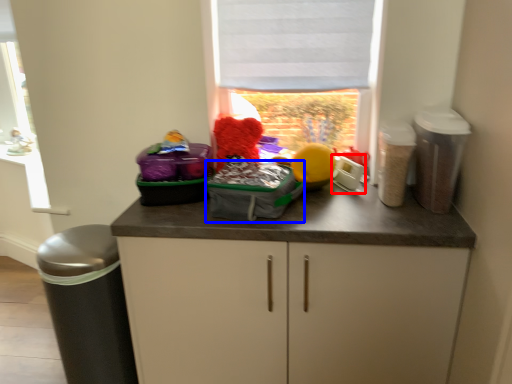
Question: Which point is closer to the camera, appliance (highlighted by a red box) or kit (highlighted by a blue box)?

Choices:
 (A) appliance
 (B) kit

Answer: (B)